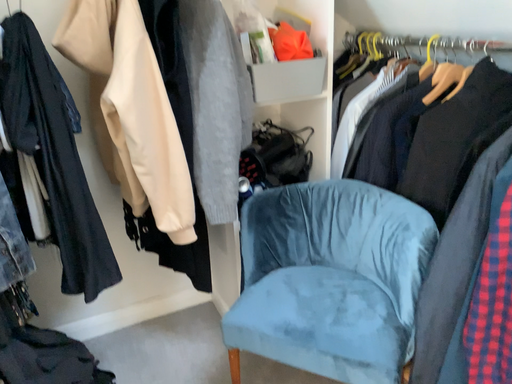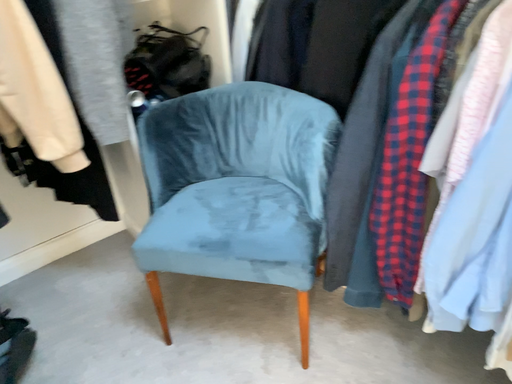
Question: How did the camera likely rotate when shooting the video?

Choices:
 (A) rotated downward
 (B) rotated upward

Answer: (A)